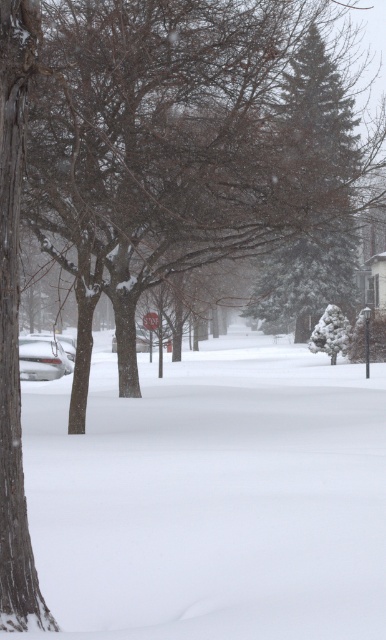
Question: Does white fluffy snow at center lie behind green textured pine tree at upper center?

Choices:
 (A) no
 (B) yes

Answer: (A)

Question: Which object appears farthest from the camera in this image?

Choices:
 (A) snow-covered tree at left
 (B) green textured pine tree at upper center

Answer: (B)

Question: Which point appears farthest from the camera in this image?

Choices:
 (A) (74, 456)
 (B) (277, 179)
 (C) (321, 147)

Answer: (C)

Question: Can you confirm if white fluffy snow at center is thinner than snow-covered tree at left?

Choices:
 (A) yes
 (B) no

Answer: (B)

Question: Which of the following is the closest to the observer?

Choices:
 (A) snow-covered tree at left
 (B) white fluffy snow at center

Answer: (B)

Question: Can you confirm if white fluffy snow at center is positioned to the right of green textured pine tree at upper center?

Choices:
 (A) no
 (B) yes

Answer: (A)